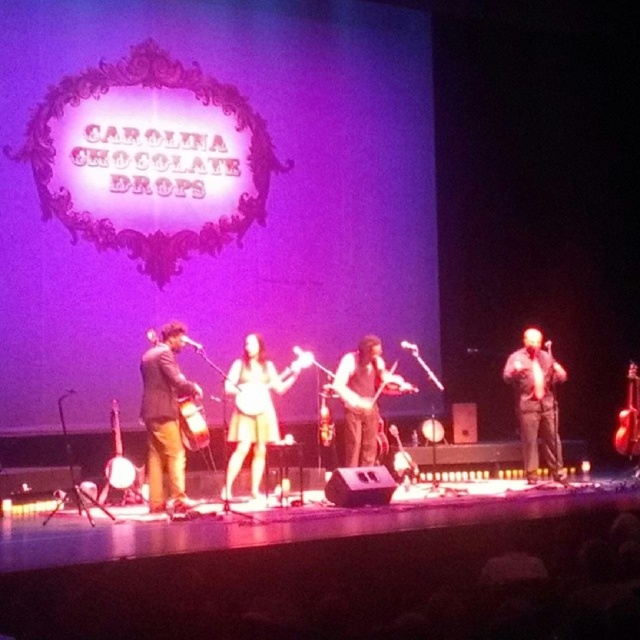
Question: Which object is farther from the camera taking this photo?

Choices:
 (A) matte brown suit at center
 (B) wooden violin at center

Answer: (A)

Question: Which object is the closest to the metallic gold banjo at center?

Choices:
 (A) yellow fabric banjo at center
 (B) brown leather guitar at center
 (C) wooden violin at center

Answer: (B)

Question: Which point is closer to the camera?

Choices:
 (A) wooden violin at center
 (B) brown leather banjo at center
 (C) brown leather guitar at center

Answer: (B)

Question: Does wooden violin at center come behind metallic gold banjo at center?

Choices:
 (A) yes
 (B) no

Answer: (B)

Question: Is wooden violin at center in front of matte wood banjo at center?

Choices:
 (A) no
 (B) yes

Answer: (A)

Question: Is the position of yellow fabric banjo at center less distant than that of brown leather guitar at center?

Choices:
 (A) yes
 (B) no

Answer: (A)